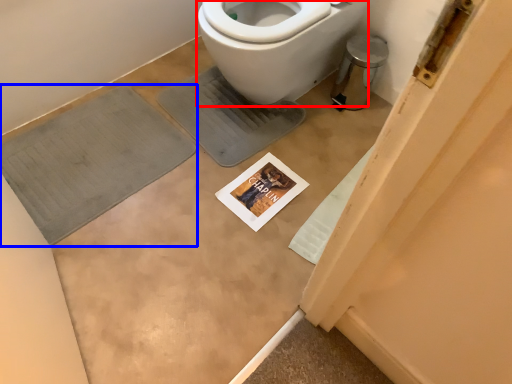
Question: Among these objects, which one is farthest to the camera, bidet (highlighted by a red box) or bath mat (highlighted by a blue box)?

Choices:
 (A) bidet
 (B) bath mat

Answer: (B)